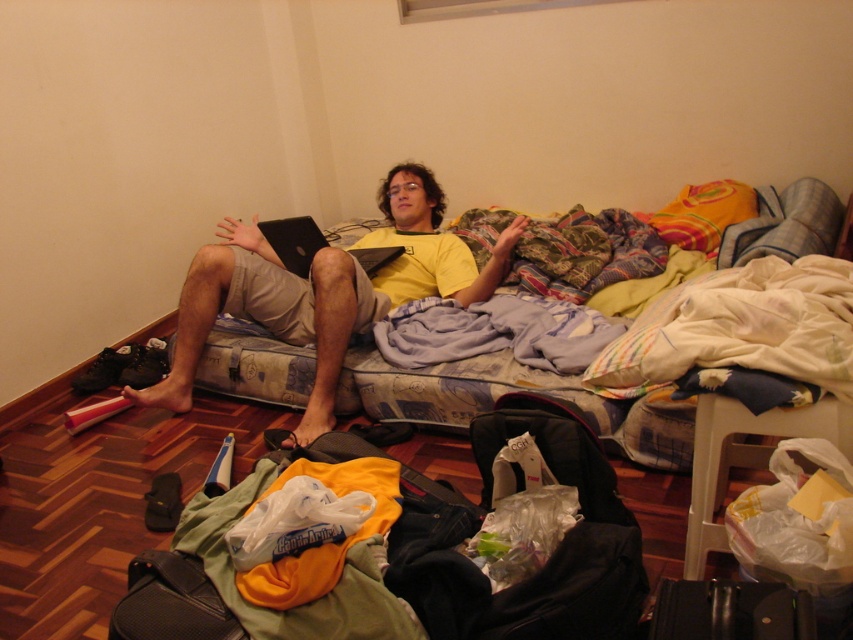
You are moving and need to pack your black matte laptop at center into your black leather suitcase at lower right. Can the laptop fit vertically inside the suitcase?

The black leather suitcase at lower right is not as tall as the black matte laptop at center, so the laptop cannot fit vertically inside the suitcase.

You are packing for a trip and need to place your black leather suitcase at lower right and black textured bag at lower left into a storage compartment that is 25 inches wide. Will both items fit side by side in the compartment?

The black leather suitcase at lower right and black textured bag at lower left are 27.15 inches apart from each other. Since the storage compartment is only 25 inches wide, the combined width of both items exceeds the available space. Therefore, they cannot fit side by side in the compartment.